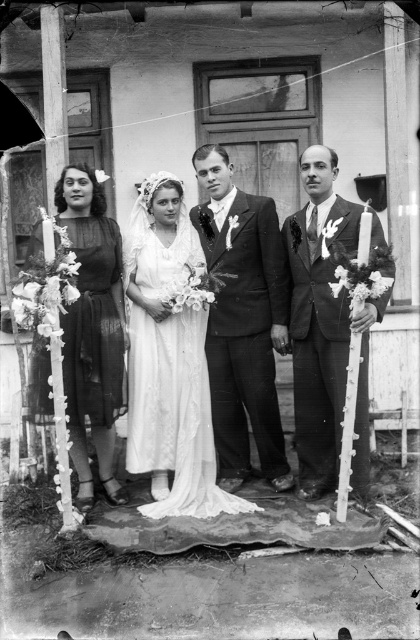
In the wedding scene, there is a point marked at coordinates (x=170, y=356). What object is located at this point?

The white satin dress at center is located at point (x=170, y=356).

You are a photographer at the wedding. You need to adjust the lighting so that the white satin dress at center and the smooth black suit at right are both well lit. Which object should you focus on first to ensure proper exposure?

The white satin dress at center is below smooth black suit at right, so you should focus on the smooth black suit at right first to ensure proper exposure because it is higher and might be in a different light zone.

Looking at the wedding scene, there is a smooth black suit at center and a matte black dress at left. Which one is positioned higher in the image?

The smooth black suit at center is positioned higher than the matte black dress at left in the image.